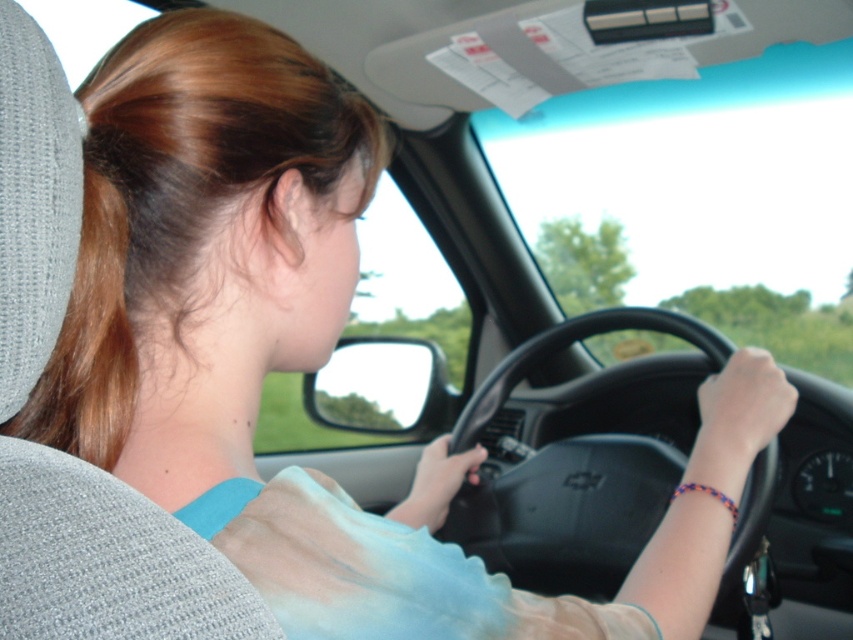
Consider the image. You are a passenger in the car and want to hand a map to the driver. The map is in your lap. The driver has brown silky hair at left. The black matte steering wheel at center is between you and the driver. Can you reach the driver without touching the steering wheel?

The black matte steering wheel at center is 1.07 meters from brown silky hair at left, so you can reach the driver without touching the steering wheel since the distance is sufficient.

You are a passenger in a car and notice the black matte steering wheel at center and the brown silky hair at left. Which object appears larger in the scene?

The black matte steering wheel at center appears much larger than the brown silky hair at left.